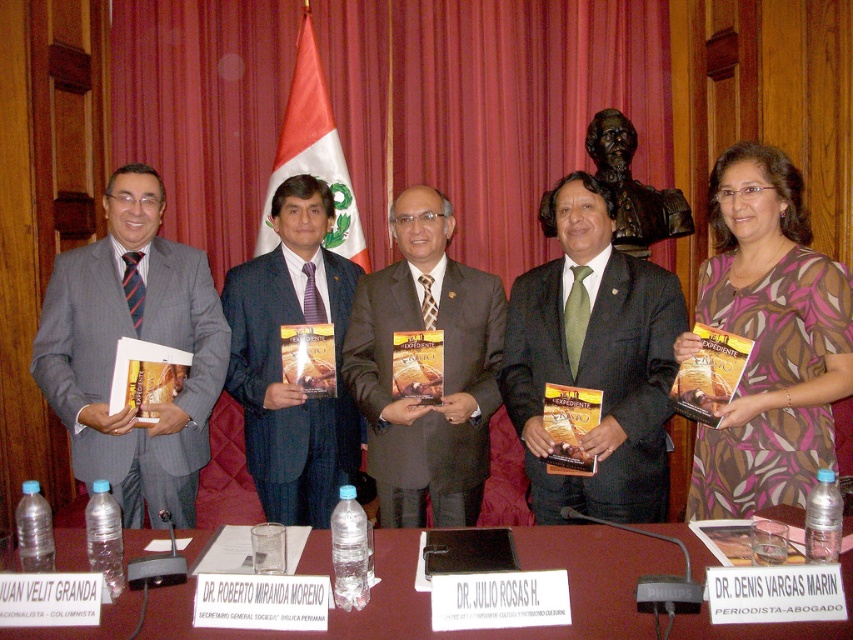
You are a photographer standing at the back of the room. You need to take a photo of the maroon wood table at center and the red fabric flag at center. How far apart are these two items from each other?

The maroon wood table at center is 2.02 meters away from the red fabric flag at center, so the distance between them is 2.02 meters.

You are planning to place a new book on the table. Considering the current setup with the maroon wood table at center and the red fabric flag at center, where exactly should you place the book to ensure it is visible under the flag?

The maroon wood table at center is positioned under the red fabric flag at center, so placing the book on the table directly beneath the flag would ensure it is visible under the flag.

You are a photographer at the event and need to capture a closeup of the patterned fabric dress at center and the gray pinstripe suit at left. Which one should you focus on first to ensure it appears sharp in the photo?

The patterned fabric dress at center is closer to the viewer than the gray pinstripe suit at left, so you should focus on the patterned fabric dress at center first to ensure it appears sharp.